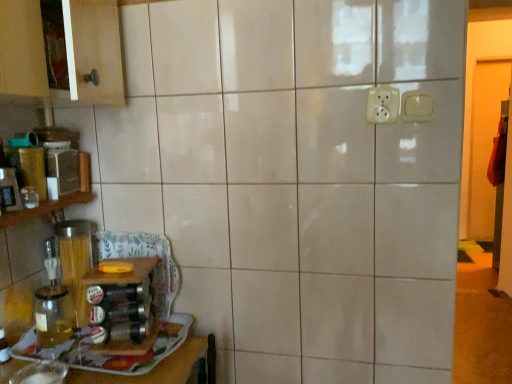
Image resolution: width=512 pixels, height=384 pixels. Describe the element at coordinates (62, 169) in the screenshot. I see `matte plastic container at left` at that location.

What do you see at coordinates (57, 199) in the screenshot? The image size is (512, 384). I see `wooden shelf at left` at bounding box center [57, 199].

The height and width of the screenshot is (384, 512). Describe the element at coordinates (144, 359) in the screenshot. I see `transparent glass jar at lower left` at that location.

What do you see at coordinates (382, 104) in the screenshot? This screenshot has height=384, width=512. I see `white plastic electric outlet at upper center, marked as the 1th electric outlet in a left-to-right arrangement` at bounding box center [382, 104].

Image resolution: width=512 pixels, height=384 pixels. Find the location of `matte plastic container at left`. matte plastic container at left is located at coordinates (62, 169).

From a real-world perspective, count 2nd electric outlets upward from the wooden shelf at left and point to it. Please provide its 2D coordinates.

[(382, 104)]

Considering the relative positions of wooden shelf at left and white plastic electric outlet at upper center, which ranks as the second electric outlet in right-to-left order, in the image provided, is wooden shelf at left to the left or to the right of white plastic electric outlet at upper center, which ranks as the second electric outlet in right-to-left order,?

Based on their positions, wooden shelf at left is located to the left of white plastic electric outlet at upper center, which ranks as the second electric outlet in right-to-left order.

Considering the relative positions of wooden shelf at left and white plastic electric outlet at upper center, marked as the 1th electric outlet in a left-to-right arrangement, in the image provided, is wooden shelf at left behind white plastic electric outlet at upper center, marked as the 1th electric outlet in a left-to-right arrangement,?

No, wooden shelf at left is in front of white plastic electric outlet at upper center, marked as the 1th electric outlet in a left-to-right arrangement.

Which is behind, point (84, 176) or point (374, 102)?

The point (84, 176) is behind.

From the image's perspective, is transparent glass jar at left on top of white plastic switch at upper right, which is counted as the second electric outlet, starting from the left?

Incorrect, from the image's perspective, transparent glass jar at left is lower than white plastic switch at upper right, which is counted as the second electric outlet, starting from the left.

Is point (49, 307) farther from camera compared to point (429, 119)?

Yes, point (49, 307) is farther from viewer.

Which is in front, transparent glass jar at left or white plastic switch at upper right, which is the first electric outlet from right to left?

white plastic switch at upper right, which is the first electric outlet from right to left, is more forward.

Considering the positions of objects transparent glass jar at left and white plastic switch at upper right, which is the first electric outlet from right to left, in the image provided, who is more to the left, transparent glass jar at left or white plastic switch at upper right, which is the first electric outlet from right to left,?

From the viewer's perspective, transparent glass jar at left appears more on the left side.

Is white plastic switch at upper right, which is counted as the second electric outlet, starting from the left, in front of transparent glass jar at left?

Yes, the depth of white plastic switch at upper right, which is counted as the second electric outlet, starting from the left, is less than that of transparent glass jar at left.

From the image's perspective, is white plastic switch at upper right, which is counted as the second electric outlet, starting from the left, on top of transparent glass jar at left?

Yes, from the image's perspective, white plastic switch at upper right, which is counted as the second electric outlet, starting from the left, is on top of transparent glass jar at left.

Would you say white plastic switch at upper right, which is counted as the second electric outlet, starting from the left, is to the left or to the right of transparent glass jar at left in the picture?

From the image, it's evident that white plastic switch at upper right, which is counted as the second electric outlet, starting from the left, is to the right of transparent glass jar at left.

How different are the orientations of white plastic switch at upper right, which is counted as the second electric outlet, starting from the left, and transparent glass jar at left in degrees?

93.4 degrees separate the facing orientations of white plastic switch at upper right, which is counted as the second electric outlet, starting from the left, and transparent glass jar at left.

Starting from the transparent glass jar at lower left, which electric outlet is the 1st one to the right? Please provide its 2D coordinates.

[(382, 104)]

In terms of size, does transparent glass jar at lower left appear bigger or smaller than white plastic electric outlet at upper center, marked as the 1th electric outlet in a left-to-right arrangement?

In the image, transparent glass jar at lower left appears to be larger than white plastic electric outlet at upper center, marked as the 1th electric outlet in a left-to-right arrangement.

Does point (181, 375) lie behind point (393, 108)?

Yes, point (181, 375) is farther from viewer.

Can you confirm if transparent glass jar at lower left is positioned to the right of white plastic electric outlet at upper center, which ranks as the second electric outlet in right-to-left order?

Incorrect, transparent glass jar at lower left is not on the right side of white plastic electric outlet at upper center, which ranks as the second electric outlet in right-to-left order.

Considering the positions of objects wooden shelf at left and transparent glass jar at lower left in the image provided, who is behind, wooden shelf at left or transparent glass jar at lower left?

transparent glass jar at lower left is more distant.

Does wooden shelf at left appear on the left side of transparent glass jar at lower left?

Indeed, wooden shelf at left is positioned on the left side of transparent glass jar at lower left.

From a real-world perspective, which is physically above, wooden shelf at left or transparent glass jar at lower left?

wooden shelf at left, from a real-world perspective.

Does point (65, 204) lie in front of point (106, 368)?

That is False.

Considering the positions of points (69, 313) and (63, 197), is point (69, 313) closer to camera compared to point (63, 197)?

That is False.

Which is more to the left, transparent glass jar at left or wooden shelf at left?

wooden shelf at left.

Does transparent glass jar at left have a larger size compared to wooden shelf at left?

Actually, transparent glass jar at left might be smaller than wooden shelf at left.

Is matte plastic container at left taller than transparent glass jar at lower left?

Correct, matte plastic container at left is much taller as transparent glass jar at lower left.

I want to click on appliance lying above the transparent glass jar at lower left (from the image's perspective), so click(62, 169).

Do you think matte plastic container at left is within transparent glass jar at lower left, or outside of it?

matte plastic container at left is not inside transparent glass jar at lower left, it's outside.

Does matte plastic container at left lie in front of transparent glass jar at lower left?

No, it is not.

Where is `shelf below the white plastic electric outlet at upper center, marked as the 1th electric outlet in a left-to-right arrangement (from a real-world perspective)`? The width and height of the screenshot is (512, 384). shelf below the white plastic electric outlet at upper center, marked as the 1th electric outlet in a left-to-right arrangement (from a real-world perspective) is located at coordinates (57, 199).

Find the location of a particular element. Image resolution: width=512 pixels, height=384 pixels. glass jar that is on the left side of white plastic switch at upper right, which is the first electric outlet from right to left is located at coordinates (53, 315).

Considering their positions, is wooden shelf at left positioned further to matte plastic container at left than transparent glass jar at left?

Among the two, transparent glass jar at left is located further to matte plastic container at left.

When comparing their distances from transparent glass jar at lower left, does matte plastic container at left or wooden shelf at left seem further?

Based on the image, matte plastic container at left appears to be further to transparent glass jar at lower left.

Which object lies nearer to the anchor point transparent glass jar at left, transparent glass jar at lower left or white plastic electric outlet at upper center, which ranks as the second electric outlet in right-to-left order?

The object closer to transparent glass jar at left is transparent glass jar at lower left.

Considering their positions, is matte plastic container at left positioned further to transparent glass jar at left than white plastic electric outlet at upper center, which ranks as the second electric outlet in right-to-left order?

Among the two, white plastic electric outlet at upper center, which ranks as the second electric outlet in right-to-left order, is located further to transparent glass jar at left.

Considering their positions, is white plastic electric outlet at upper center, which ranks as the second electric outlet in right-to-left order, positioned closer to matte plastic container at left than white plastic switch at upper right, which is counted as the second electric outlet, starting from the left?

white plastic electric outlet at upper center, which ranks as the second electric outlet in right-to-left order.

From the image, which object appears to be farther from wooden shelf at left, white plastic electric outlet at upper center, which ranks as the second electric outlet in right-to-left order, or transparent glass jar at lower left?

Based on the image, white plastic electric outlet at upper center, which ranks as the second electric outlet in right-to-left order, appears to be further to wooden shelf at left.

Based on their spatial positions, is transparent glass jar at lower left or transparent glass jar at left closer to wooden shelf at left?

Among the two, transparent glass jar at left is located nearer to wooden shelf at left.

In the scene shown: From the image, which object appears to be nearer to white plastic electric outlet at upper center, marked as the 1th electric outlet in a left-to-right arrangement, white plastic switch at upper right, which is counted as the second electric outlet, starting from the left, or wooden shelf at left?

The object closer to white plastic electric outlet at upper center, marked as the 1th electric outlet in a left-to-right arrangement, is white plastic switch at upper right, which is counted as the second electric outlet, starting from the left.

This screenshot has width=512, height=384. Find the location of `electric outlet situated between wooden shelf at left and white plastic switch at upper right, which is counted as the second electric outlet, starting from the left, from left to right`. electric outlet situated between wooden shelf at left and white plastic switch at upper right, which is counted as the second electric outlet, starting from the left, from left to right is located at coordinates (382, 104).

This screenshot has width=512, height=384. Find the location of `appliance situated between wooden shelf at left and white plastic switch at upper right, which is counted as the second electric outlet, starting from the left, from left to right`. appliance situated between wooden shelf at left and white plastic switch at upper right, which is counted as the second electric outlet, starting from the left, from left to right is located at coordinates (62, 169).

Locate an element on the screen. shelf that lies between matte plastic container at left and transparent glass jar at left from top to bottom is located at coordinates (57, 199).

Where is `glass jar between wooden shelf at left and white plastic switch at upper right, which is the first electric outlet from right to left, from left to right`? This screenshot has height=384, width=512. glass jar between wooden shelf at left and white plastic switch at upper right, which is the first electric outlet from right to left, from left to right is located at coordinates (53, 315).